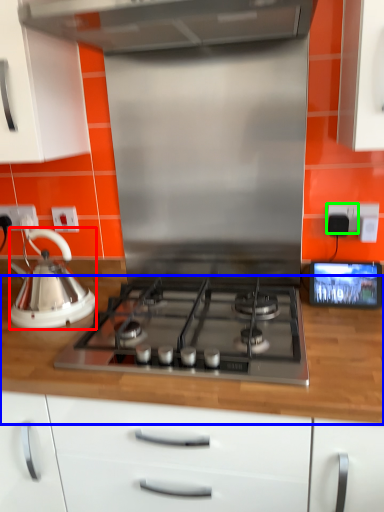
Question: Estimate the real-world distances between objects in this image. Which object is closer to kettle (highlighted by a red box), countertop (highlighted by a blue box) or electric outlet (highlighted by a green box)?

Choices:
 (A) countertop
 (B) electric outlet

Answer: (A)